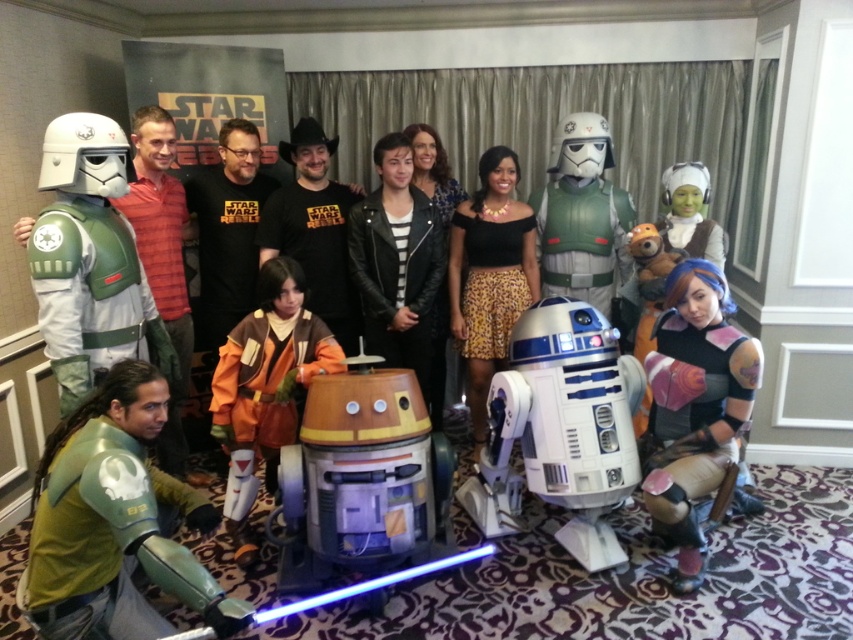
Is point (138, 540) closer to camera compared to point (601, 134)?

Yes, point (138, 540) is closer to viewer.

Who is positioned more to the right, green matte armor at lower left or green plastic stormtrooper at center?

green plastic stormtrooper at center

Which is in front, point (125, 531) or point (601, 200)?

Positioned in front is point (125, 531).

Identify the location of green matte armor at lower left. This screenshot has width=853, height=640. (100, 536).

Who is higher up, green fabric costume at center or green plastic stormtrooper at center?

green plastic stormtrooper at center is above.

Who is more forward, (x=679, y=484) or (x=561, y=256)?

Point (x=679, y=484)

Identify the location of green fabric costume at center. (590, 440).

Does leather jacket at center appear over leopard print skirt at center?

No.

What are the coordinates of `leather jacket at center` in the screenshot? It's located at (398, 280).

Is point (416, 371) more distant than point (451, 225)?

That is False.

Identify the location of leather jacket at center. (398, 280).